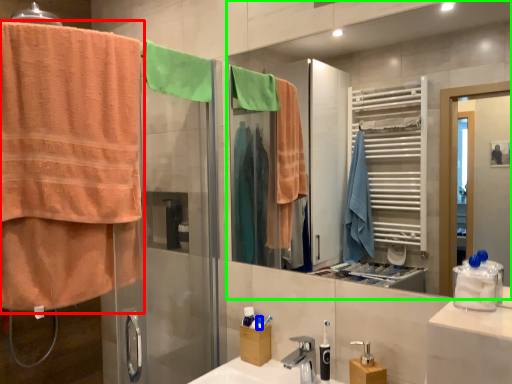
Question: Estimate the real-world distances between objects in this image. Which object is closer to towel (highlighted by a red box), toiletry (highlighted by a blue box) or mirror (highlighted by a green box)?

Choices:
 (A) toiletry
 (B) mirror

Answer: (A)